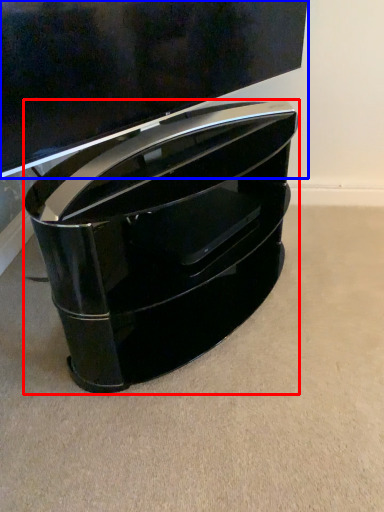
Question: Which point is further to the camera, furniture (highlighted by a red box) or television (highlighted by a blue box)?

Choices:
 (A) furniture
 (B) television

Answer: (A)